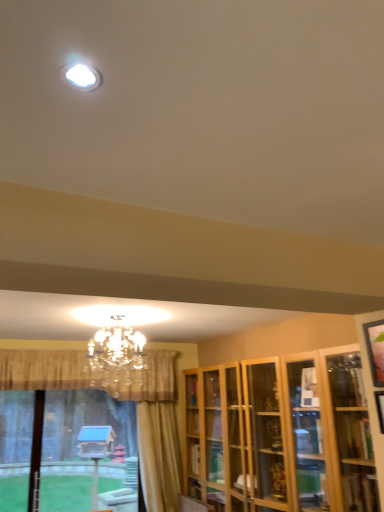
Question: Is crystal chandelier at upper center aimed at wooden cabinet at right?

Choices:
 (A) yes
 (B) no

Answer: (B)

Question: Considering the relative positions of crystal chandelier at upper center and wooden cabinet at right in the image provided, is crystal chandelier at upper center to the right of wooden cabinet at right from the viewer's perspective?

Choices:
 (A) no
 (B) yes

Answer: (A)

Question: Is wooden cabinet at right inside crystal chandelier at upper center?

Choices:
 (A) no
 (B) yes

Answer: (A)

Question: Is crystal chandelier at upper center wider than wooden cabinet at right?

Choices:
 (A) yes
 (B) no

Answer: (A)

Question: From the image's perspective, is crystal chandelier at upper center under wooden cabinet at right?

Choices:
 (A) no
 (B) yes

Answer: (A)

Question: Is crystal chandelier at upper center next to wooden cabinet at right and touching it?

Choices:
 (A) no
 (B) yes

Answer: (A)

Question: Is translucent glass bay window at lower left wider than white glossy light fixture at upper center?

Choices:
 (A) no
 (B) yes

Answer: (B)

Question: Is translucent glass bay window at lower left shorter than white glossy light fixture at upper center?

Choices:
 (A) yes
 (B) no

Answer: (B)

Question: Is translucent glass bay window at lower left directly adjacent to white glossy light fixture at upper center?

Choices:
 (A) yes
 (B) no

Answer: (B)

Question: Considering the relative sizes of translucent glass bay window at lower left and white glossy light fixture at upper center in the image provided, is translucent glass bay window at lower left smaller than white glossy light fixture at upper center?

Choices:
 (A) yes
 (B) no

Answer: (B)

Question: Considering the relative sizes of translucent glass bay window at lower left and white glossy light fixture at upper center in the image provided, is translucent glass bay window at lower left taller than white glossy light fixture at upper center?

Choices:
 (A) yes
 (B) no

Answer: (A)

Question: Would you consider translucent glass bay window at lower left to be distant from white glossy light fixture at upper center?

Choices:
 (A) no
 (B) yes

Answer: (B)

Question: Is the surface of white glossy light fixture at upper center in direct contact with wooden cabinet at right?

Choices:
 (A) yes
 (B) no

Answer: (B)